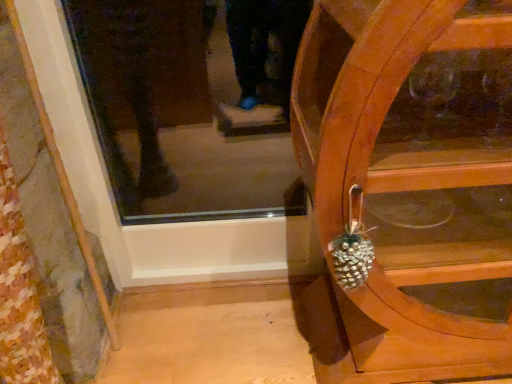
Question: From a real-world perspective, does shiny metallic pinecone at right stand above wooden cabinet at right?

Choices:
 (A) yes
 (B) no

Answer: (A)

Question: Is shiny metallic pinecone at right at the left side of wooden cabinet at right?

Choices:
 (A) no
 (B) yes

Answer: (B)

Question: From the image's perspective, would you say shiny metallic pinecone at right is shown under wooden cabinet at right?

Choices:
 (A) no
 (B) yes

Answer: (B)

Question: Is shiny metallic pinecone at right thinner than wooden cabinet at right?

Choices:
 (A) yes
 (B) no

Answer: (A)

Question: Is shiny metallic pinecone at right behind wooden cabinet at right?

Choices:
 (A) no
 (B) yes

Answer: (B)

Question: Is shiny metallic pinecone at right positioned with its back to wooden cabinet at right?

Choices:
 (A) yes
 (B) no

Answer: (A)

Question: From a real-world perspective, is wooden cabinet at right over shiny metallic pinecone at right?

Choices:
 (A) yes
 (B) no

Answer: (B)

Question: Are wooden cabinet at right and shiny metallic pinecone at right beside each other?

Choices:
 (A) no
 (B) yes

Answer: (A)

Question: Is the position of wooden cabinet at right more distant than that of shiny metallic pinecone at right?

Choices:
 (A) yes
 (B) no

Answer: (B)

Question: Is shiny metallic pinecone at right located within wooden cabinet at right?

Choices:
 (A) no
 (B) yes

Answer: (A)

Question: Is wooden cabinet at right at the right side of shiny metallic pinecone at right?

Choices:
 (A) yes
 (B) no

Answer: (A)

Question: Does wooden cabinet at right have a lesser height compared to shiny metallic pinecone at right?

Choices:
 (A) yes
 (B) no

Answer: (B)

Question: Considering the positions of point (504, 347) and point (352, 286), is point (504, 347) closer or farther from the camera than point (352, 286)?

Choices:
 (A) closer
 (B) farther

Answer: (B)